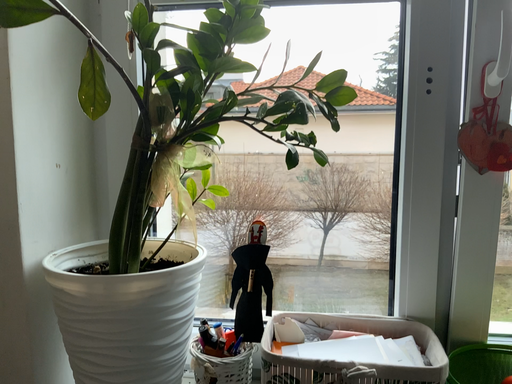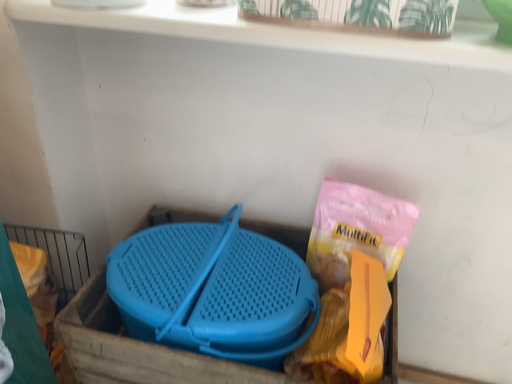
Question: How did the camera likely rotate when shooting the video?

Choices:
 (A) rotated upward
 (B) rotated downward

Answer: (B)